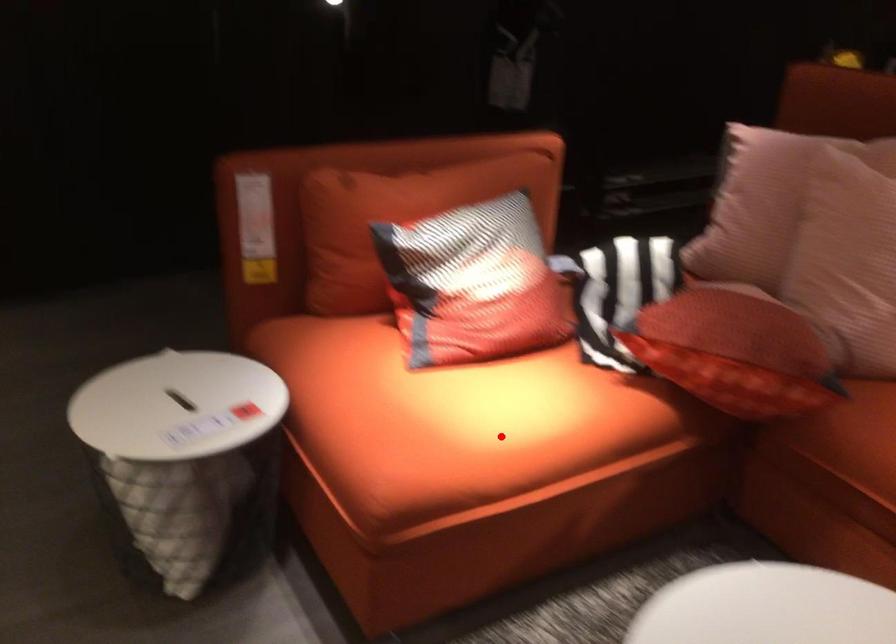
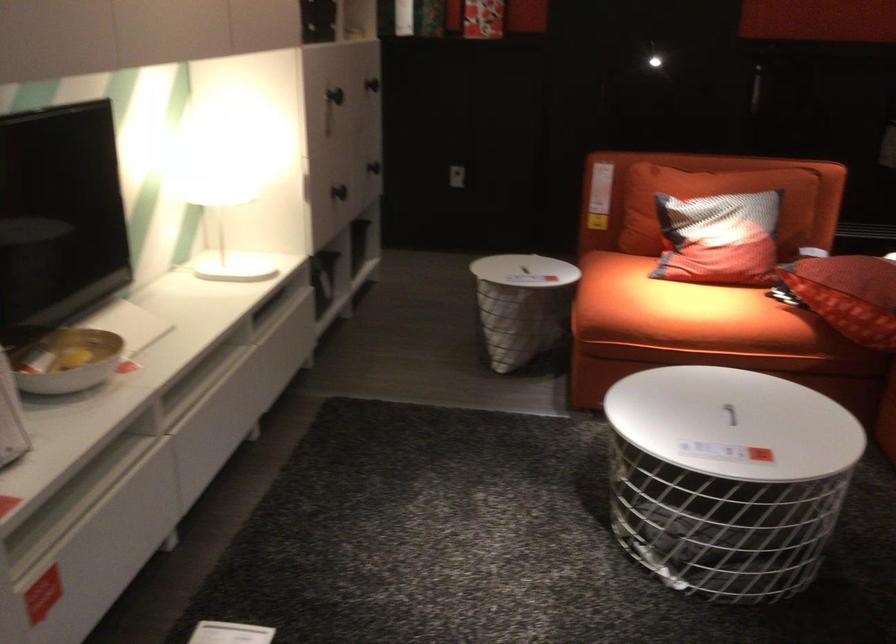
Question: I am providing you with two images of the same scene from different viewpoints. Given a red point in image1, look at the same physical point in image2. Is it:

Choices:
 (A) Closer to the viewpoint
 (B) Farther from the viewpoint

Answer: (B)